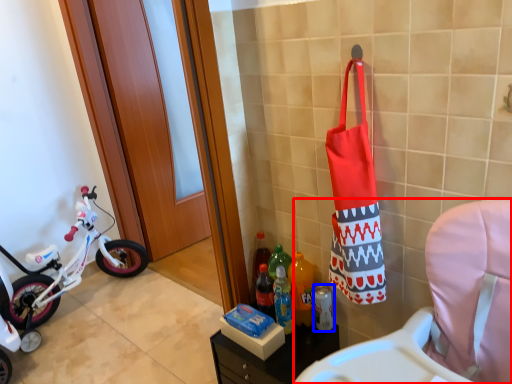
Question: Which object appears farthest to the camera in this image, rocking chair (highlighted by a red box) or bottle (highlighted by a blue box)?

Choices:
 (A) rocking chair
 (B) bottle

Answer: (B)